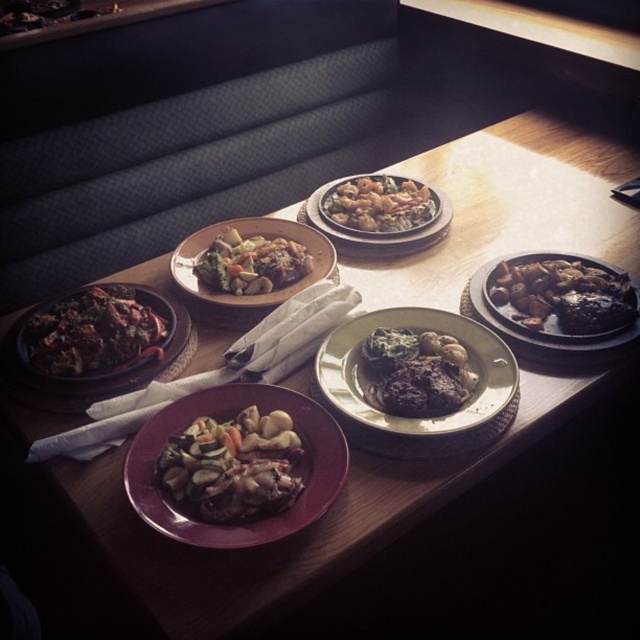
Between shiny dark brown meat at right and shiny metallic bowl at center, which one has more height?

shiny dark brown meat at right

Can you confirm if shiny dark brown meat at right is positioned below shiny metallic bowl at center?

Correct, shiny dark brown meat at right is located below shiny metallic bowl at center.

The width and height of the screenshot is (640, 640). What do you see at coordinates (561, 296) in the screenshot?
I see `shiny dark brown meat at right` at bounding box center [561, 296].

Locate an element on the screen. The height and width of the screenshot is (640, 640). shiny dark brown meat at right is located at coordinates (561, 296).

Who is higher up, dark brown glossy meat at left or shiny dark brown meat at right?

Positioned higher is shiny dark brown meat at right.

This screenshot has height=640, width=640. Describe the element at coordinates (97, 332) in the screenshot. I see `dark brown glossy meat at left` at that location.

At what (x,y) coordinates should I click in order to perform the action: click on dark brown glossy meat at left. Please return your answer as a coordinate pair (x, y). Looking at the image, I should click on tap(97, 332).

Who is shorter, matte ceramic plate at center or shiny brown meat at center?

shiny brown meat at center is shorter.

Which is behind, point (332, 451) or point (413, 365)?

The point (413, 365) is behind.

Is point (211, 388) farther from camera compared to point (420, 401)?

Yes.

I want to click on matte ceramic plate at center, so click(x=225, y=419).